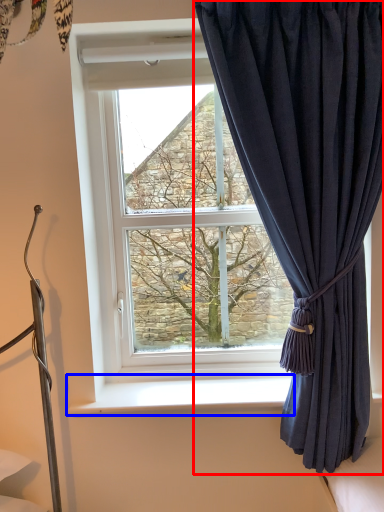
Question: Among these objects, which one is farthest to the camera, curtain (highlighted by a red box) or window sill (highlighted by a blue box)?

Choices:
 (A) curtain
 (B) window sill

Answer: (B)